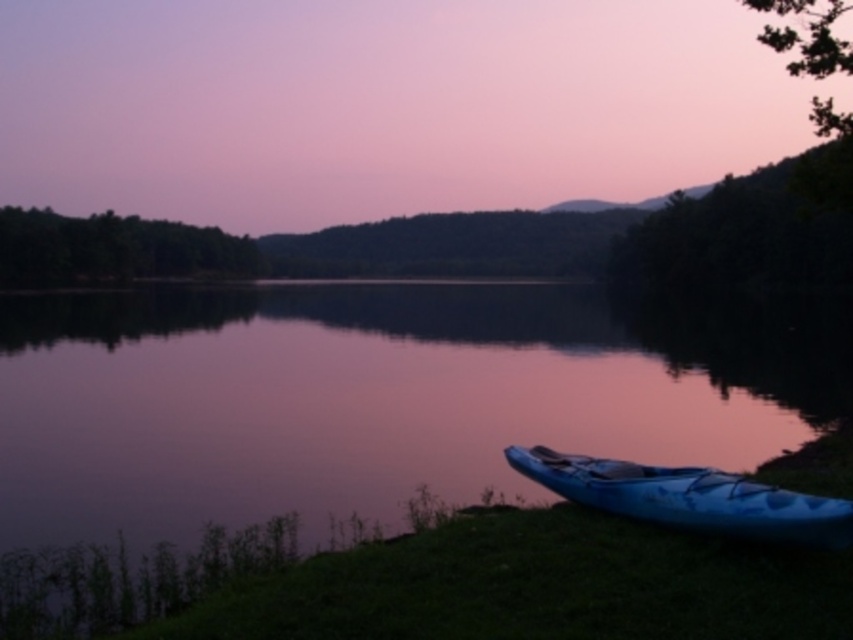
You are standing on the lakeside and want to take a photo of the smooth water at lake center and the blue glossy kayak at lower right. Which object should you focus on first if you want both to be in sharp focus?

You should focus on the blue glossy kayak at lower right first because it is farther away from the viewer than the smooth water at lake center, ensuring the closer object is in focus and the farther one is also sharp due to the depth of field.

You are a photographer planning to capture the reflection of the smooth water at lake center in your shot. To ensure the reflection is centered in your photo, where should you aim your camera? Please provide coordinates based on the image grid system where the bottom left corner is the origin point.

The smooth water at lake center is located at coordinates point (376, 396), so you should aim your camera at that point to center its reflection in the photo.

You are an observer standing on the lakeside shore. You see the smooth water at lake center and the blue glossy kayak at lower right. Which object appears taller in the image?

The smooth water at lake center appears taller than the blue glossy kayak at lower right in the image.